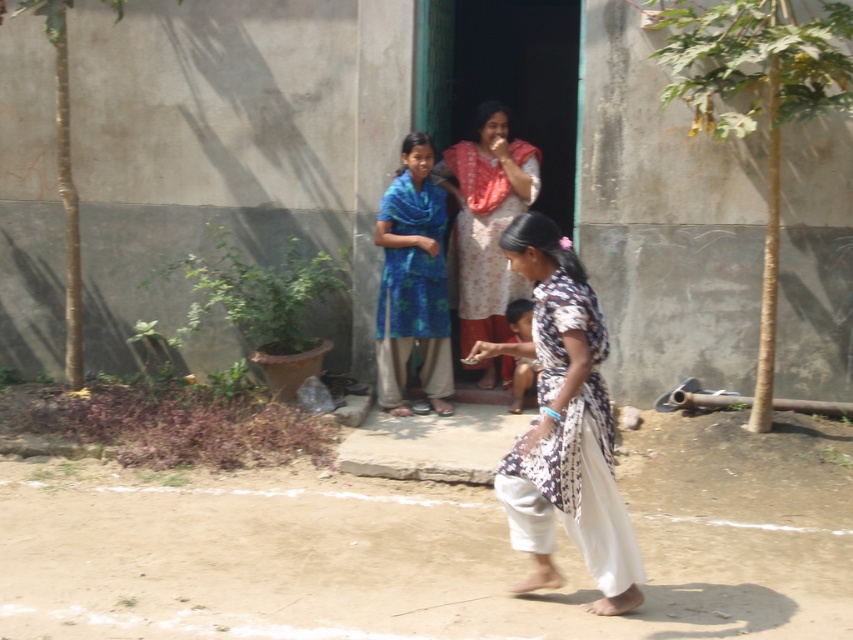
You are standing at the point (427, 314) and want to reach the doorway of the house. The distance between you and the doorway is 7.73 meters. If you walk straight towards the doorway, will you pass by the small tree to the right of the doorway?

The small tree is to the right of the doorway. Since you are walking straight towards the doorway, you will not pass by the small tree to the right of the doorway.